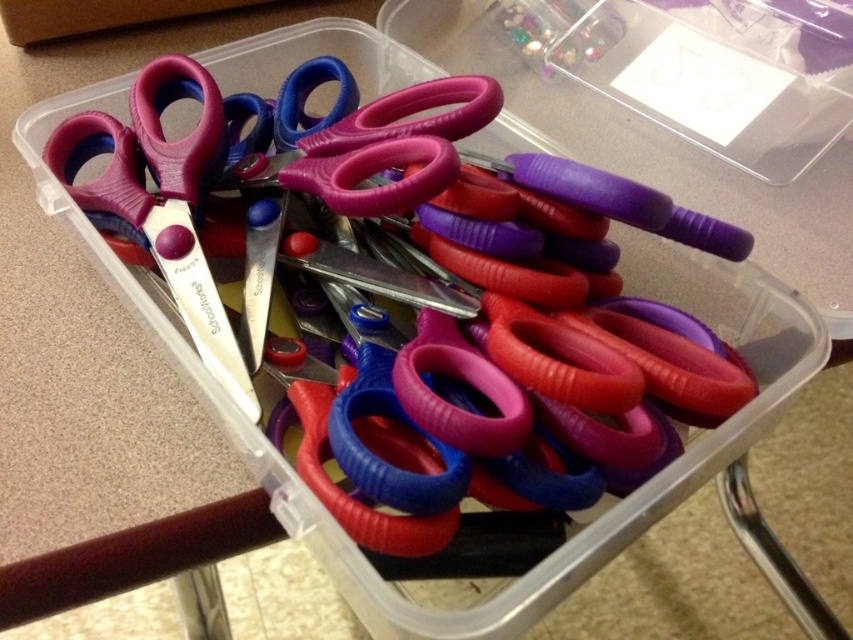
You are organizing the scissors in the clear plastic container. You need to retrieve the matte purple scissors at left. Are they on top of or below the matte plastic scissors at center?

The matte purple scissors at left are located above the matte plastic scissors at center, so they are on top.

You are organizing a craft room and need to know the height of the scissors to fit them into a drawer. Which of the two scissors, the matte plastic scissors at center or the matte purple scissors at left, is taller?

The matte plastic scissors at center is taller than the matte purple scissors at left.

You are a delivery robot with a height of 24 inches. You need to place a package on the flat surface where the matte plastic scissors at center are located. Will the package be visible to someone standing directly in front of the container?

The matte plastic scissors at center are 23.82 inches away from the camera, which is less than the robot height of 24 inches. Therefore, the package placed by the robot would be slightly higher than the camera position, potentially making it visible to someone standing directly in front of the container.